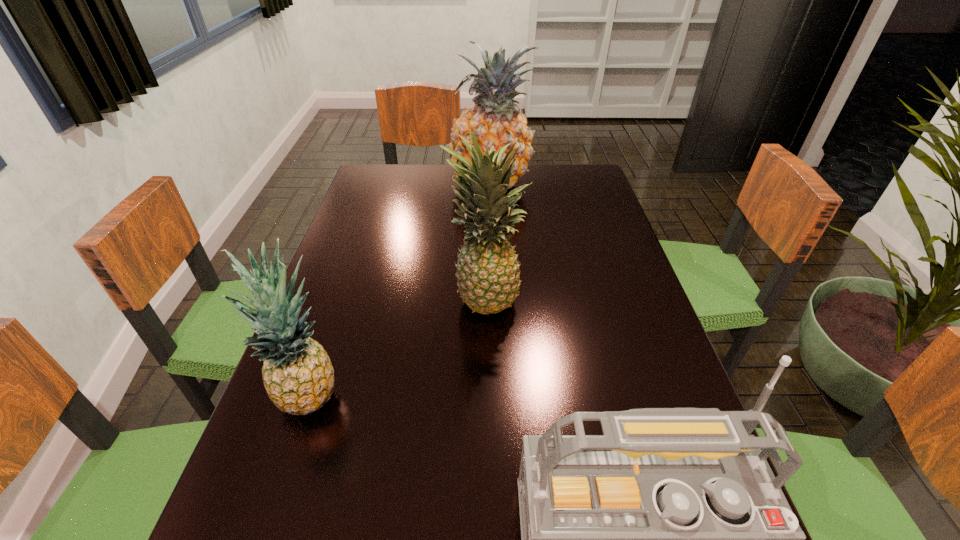
Find the location of `the farthest object`. the farthest object is located at coordinates (495, 120).

Locate an element on the screen. The height and width of the screenshot is (540, 960). the second nearest pineapple is located at coordinates (488, 273).

Where is `the nearest pineapple`? This screenshot has height=540, width=960. the nearest pineapple is located at coordinates (298, 376).

You are a GUI agent. You are given a task and a screenshot of the screen. Output one action in this format:
    pyautogui.click(x=<x>, y=<y>)
    Task: Click on the third farthest object
    
    Given the screenshot: What is the action you would take?
    pyautogui.click(x=298, y=376)

The width and height of the screenshot is (960, 540). I want to click on free space located on the front of the farthest object, so click(493, 270).

Find the location of a particular element. blank space located on the back of the second nearest pineapple is located at coordinates (484, 193).

This screenshot has width=960, height=540. I want to click on blank area located 0.210m on the right of the second nearest object, so click(x=454, y=395).

Find the location of a particular element. Image resolution: width=960 pixels, height=540 pixels. object that is positioned at the far edge is located at coordinates (495, 120).

Identify the location of object located at the left edge. (298, 376).

In the image, there is a desktop. Where is `vacant space at the left edge`? The height and width of the screenshot is (540, 960). vacant space at the left edge is located at coordinates (264, 444).